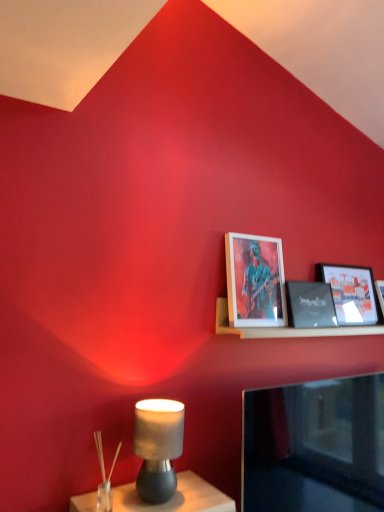
Question: From the image's perspective, is matte black picture frame at upper right, acting as the 2th picture frame starting from the left, positioned above or below matte black picture frame at upper right, the 1th picture frame viewed from the right?

Choices:
 (A) above
 (B) below

Answer: (B)

Question: From a real-world perspective, is matte black picture frame at upper right, acting as the 2th picture frame starting from the left, physically located above or below matte black picture frame at upper right, the 1th picture frame viewed from the right?

Choices:
 (A) above
 (B) below

Answer: (B)

Question: Based on their relative distances, which object is farther from the black glossy tv at lower right?

Choices:
 (A) wooden frame at upper right, acting as the 3th picture frame starting from the right
 (B) matte gray lamp at lower left
 (C) wooden shelf at upper right
 (D) matte black picture frame at upper right, acting as the 2th picture frame starting from the left
 (E) matte black picture frame at upper right, placed as the third picture frame when sorted from left to right

Answer: (E)

Question: Which of these objects is positioned farthest from the wooden shelf at upper right?

Choices:
 (A) matte gray lamp at lower left
 (B) black glossy tv at lower right
 (C) wooden frame at upper right, marked as the 1th picture frame in a left-to-right arrangement
 (D) matte black picture frame at upper right, the second picture frame viewed from the right
 (E) matte black picture frame at upper right, the 1th picture frame viewed from the right

Answer: (A)